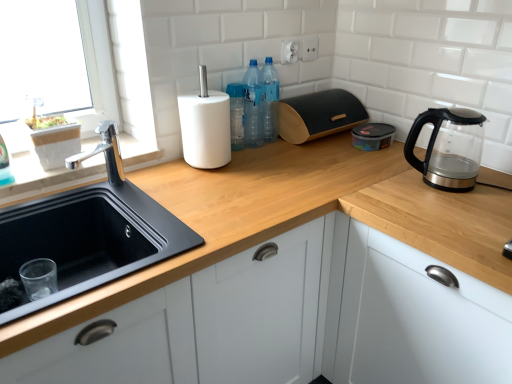
This screenshot has width=512, height=384. Identify the location of unoccupied region to the right of chrome metallic faucet at left. (146, 191).